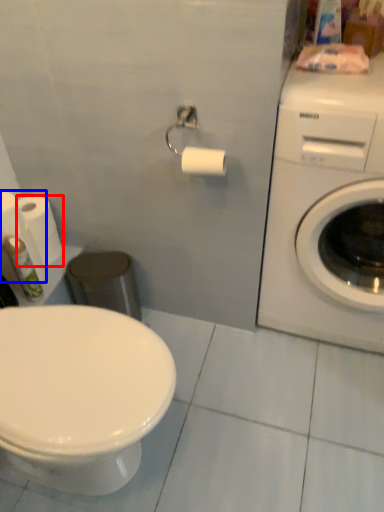
Question: Which of the following is the closest to the observer, toilet paper (highlighted by a red box) or toilet paper (highlighted by a blue box)?

Choices:
 (A) toilet paper
 (B) toilet paper

Answer: (B)